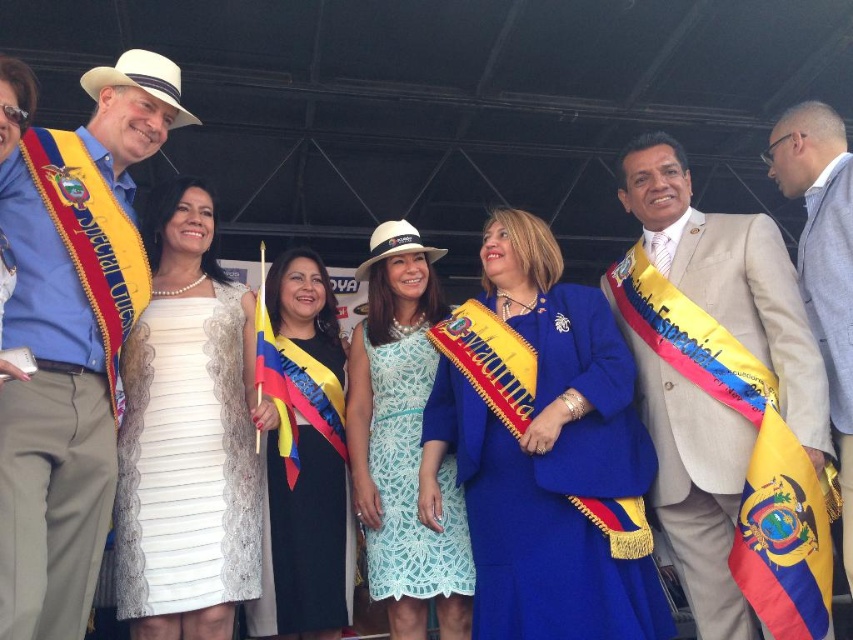
You are a photographer positioned in front of the group under the tent. You want to take a photo that includes both the lace fabric dress at center and the yellowflag at right. Which object will appear closer to the camera in the photo?

The lace fabric dress at center will appear closer to the camera in the photo because it is positioned further to the viewer than the yellowflag at right.